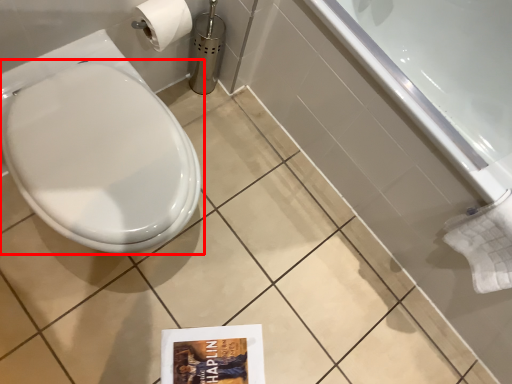
Question: Observing the image, what is the correct spatial positioning of toilet (annotated by the red box) in reference to bath?

Choices:
 (A) left
 (B) right

Answer: (A)